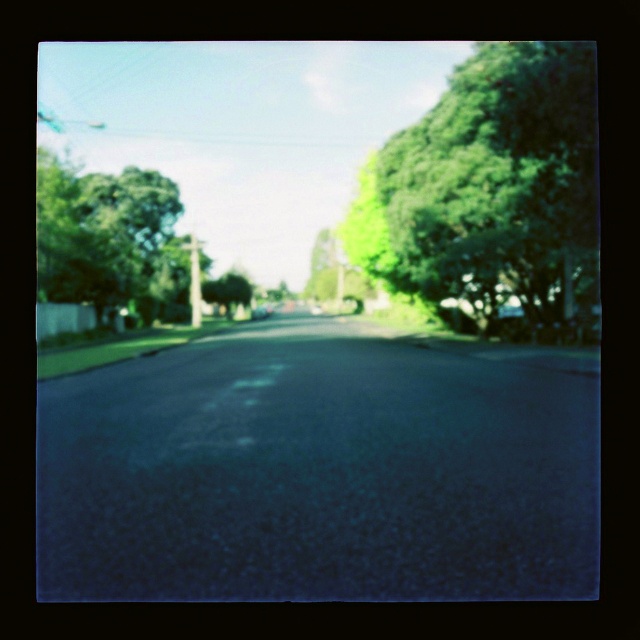
Describe the element at coordinates (492, 195) in the screenshot. I see `green leafy tree at right` at that location.

The height and width of the screenshot is (640, 640). What are the coordinates of `green leafy tree at right` in the screenshot? It's located at (492, 195).

In the scene shown: Which is above, green leafy tree at right or green leafy tree at left?

green leafy tree at left

Is point (470, 186) behind point (83, 180)?

No, (470, 186) is in front of (83, 180).

Does point (460, 163) lie in front of point (58, 225)?

That is True.

Where is `green leafy tree at right`? green leafy tree at right is located at coordinates (492, 195).

Which is behind, point (136, 307) or point (208, 300)?

Positioned behind is point (208, 300).

Can you confirm if green leafy tree at left is positioned above green leafy tree at center?

Yes.

Is point (77, 282) positioned after point (220, 301)?

No.

Identify the location of green leafy tree at left. (109, 241).